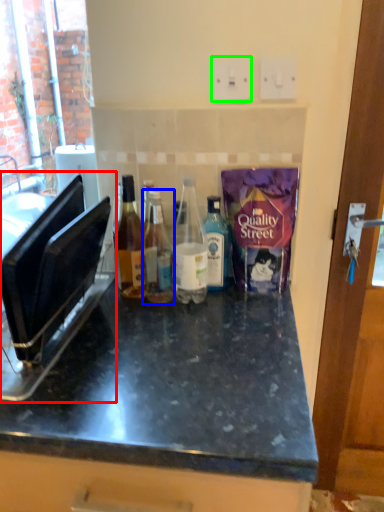
Question: Considering the real-world distances, which object is farthest from appliance (highlighted by a red box)? bottle (highlighted by a blue box) or electric outlet (highlighted by a green box)?

Choices:
 (A) bottle
 (B) electric outlet

Answer: (B)